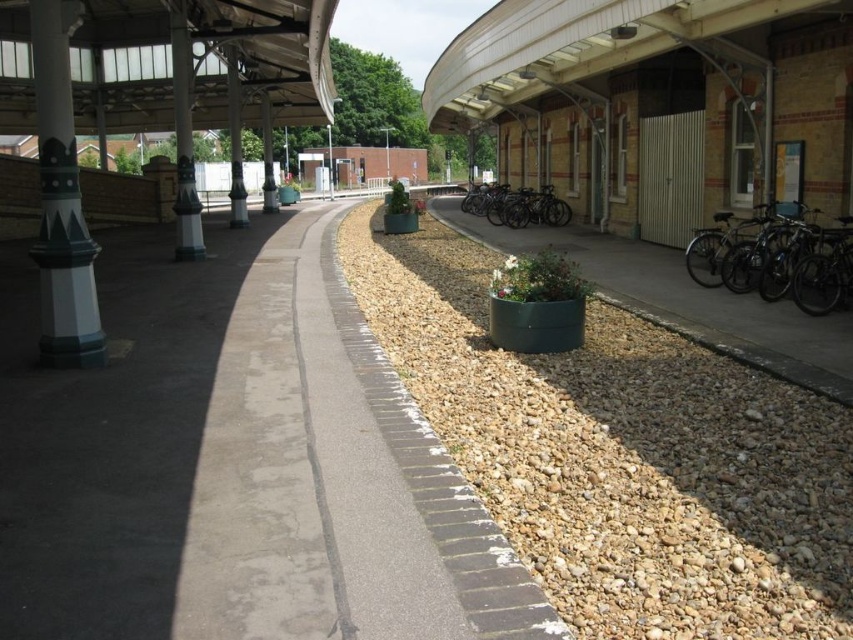
Question: Which of the following is the closest to the observer?

Choices:
 (A) (235, 138)
 (B) (134, 509)

Answer: (B)

Question: From the image, what is the correct spatial relationship of green plastic planter at center in relation to shiny metallic bicycles at right?

Choices:
 (A) above
 (B) below

Answer: (A)

Question: In this image, where is gray concrete pavement at center located relative to green painted metal column at left?

Choices:
 (A) right
 (B) left

Answer: (A)

Question: Which is nearer to the green painted metal column at left?

Choices:
 (A) shiny metallic bicycle at center
 (B) shiny metallic bicycles at right
 (C) brown gravel at center

Answer: (C)

Question: Does shiny metallic bicycle at center appear under black polished pillar at center?

Choices:
 (A) yes
 (B) no

Answer: (A)

Question: Considering the real-world distances, which object is farthest from the shiny metallic bicycles at right?

Choices:
 (A) green painted concrete pillar at left
 (B) green plastic planter at center
 (C) gray concrete pavement at center
 (D) black polished pillar at center

Answer: (D)